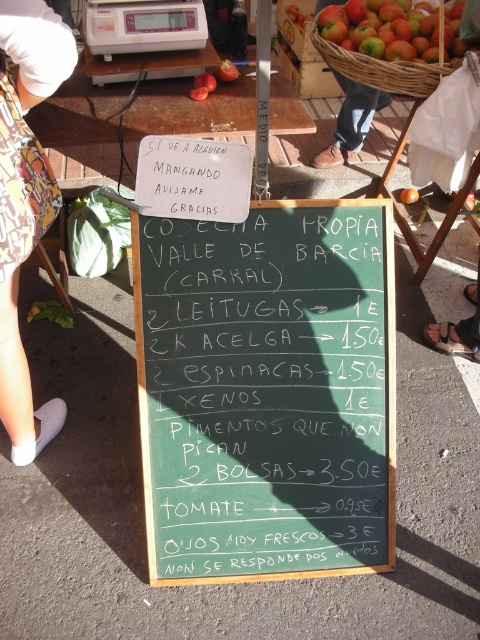
You are at the market stall and want to place a basket between the ripe red apples at upper right and the orange matte tomato at center. The basket is 20 inches wide. Will it fit between them?

The distance between the ripe red apples at upper right and the orange matte tomato at center is 33.73 inches. Since the basket is 20 inches wide, there is enough space to place it between them.

You are a customer at the market stall and want to buy both the ripe red apples at upper right and the orange matte tomato at center. Which item is located to the left of the other?

The ripe red apples at upper right is positioned on the left side of orange matte tomato at center.